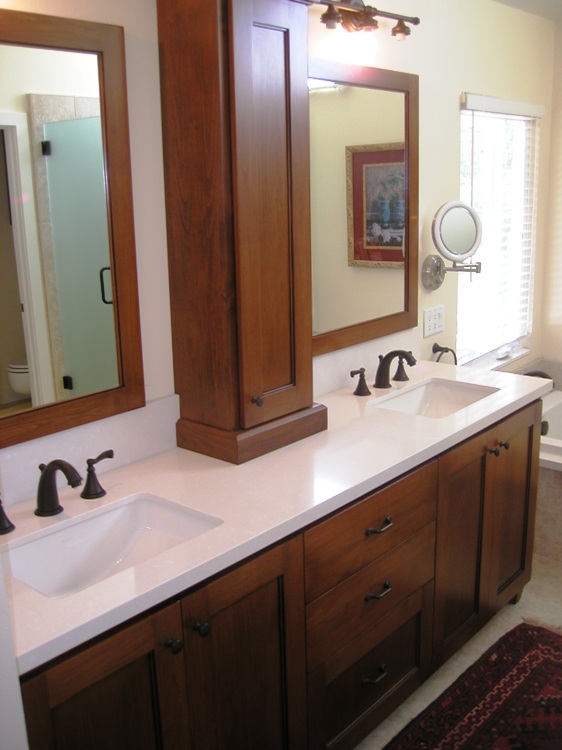
In order to click on reflection of toilet in this screenshot , I will do pos(13,375).